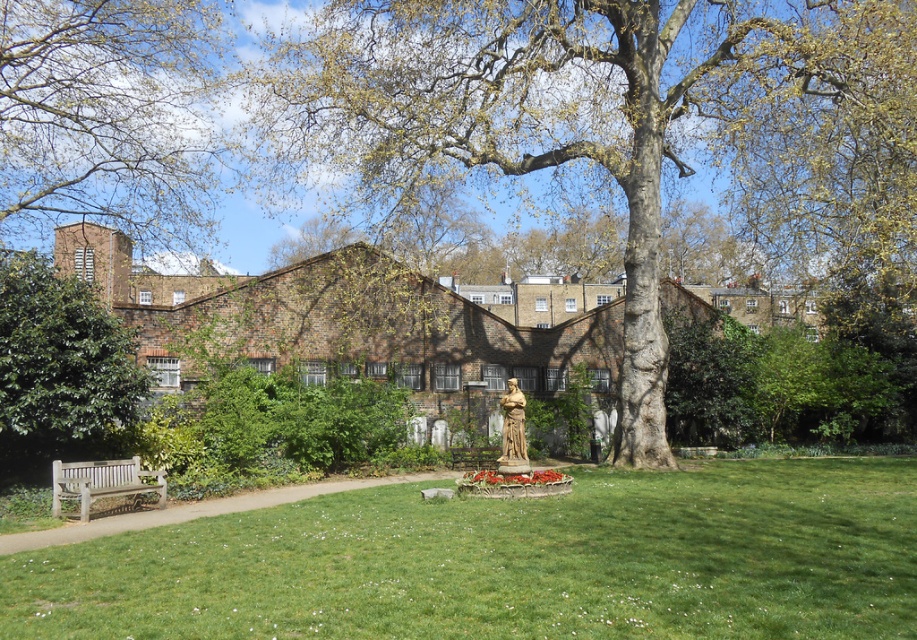
Question: Among these objects, which one is farthest from the camera?

Choices:
 (A) stone statue at center
 (B) green leafy tree at upper left
 (C) smooth brown tree trunk at center

Answer: (B)

Question: Is green leafy tree at upper left wider than wooden bench at lower left?

Choices:
 (A) no
 (B) yes

Answer: (B)

Question: Which object is the farthest from the green leafy tree at upper left?

Choices:
 (A) stone statue at center
 (B) green leafy tree at left
 (C) green grassy at center

Answer: (A)

Question: Can you confirm if green leafy tree at upper left is thinner than green leafy tree at left?

Choices:
 (A) no
 (B) yes

Answer: (A)

Question: Does green grassy at center have a lesser width compared to stone statue at center?

Choices:
 (A) yes
 (B) no

Answer: (B)

Question: Which point is farther to the camera?

Choices:
 (A) (112, 468)
 (B) (840, 552)
 (C) (761, 120)
 (D) (94, 365)

Answer: (C)